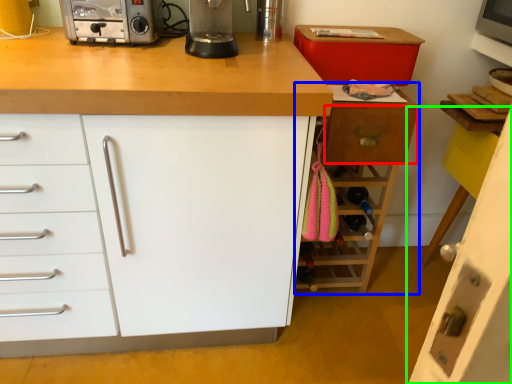
Question: Considering the real-world distances, which object is farthest from drawer (highlighted by a red box)? cabinetry (highlighted by a blue box) or cabinetry (highlighted by a green box)?

Choices:
 (A) cabinetry
 (B) cabinetry

Answer: (B)